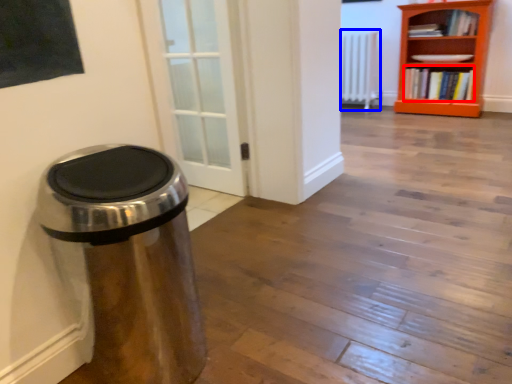
Question: Which point is closer to the camera, book (highlighted by a red box) or radiator (highlighted by a blue box)?

Choices:
 (A) book
 (B) radiator

Answer: (A)